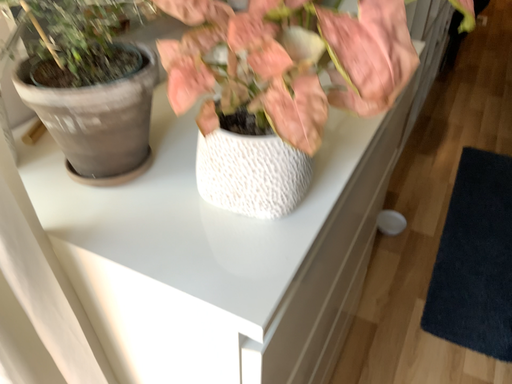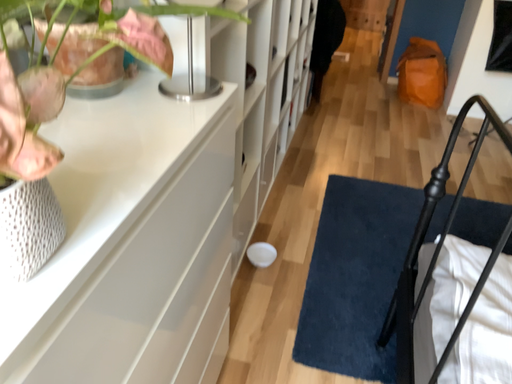
Question: How did the camera likely rotate when shooting the video?

Choices:
 (A) rotated left
 (B) rotated right

Answer: (B)